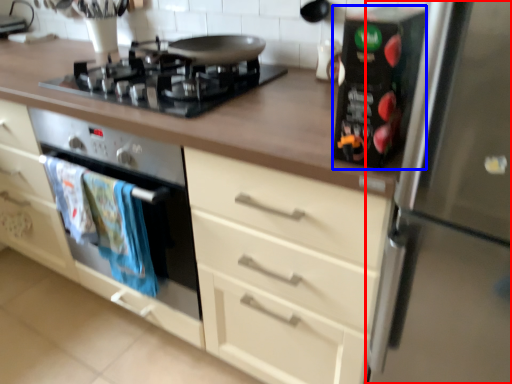
Question: Which object is closer to the camera taking this photo, refrigerator (highlighted by a red box) or appliance (highlighted by a blue box)?

Choices:
 (A) refrigerator
 (B) appliance

Answer: (A)